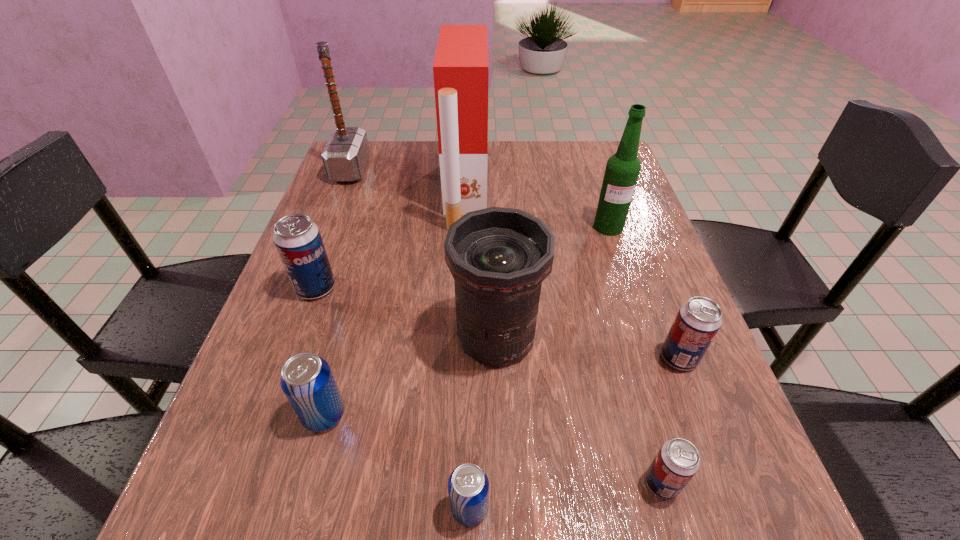
In order to click on vacant region at the near edge in this screenshot , I will do `click(634, 511)`.

Find the location of a particular element. free location at the left edge is located at coordinates (327, 350).

In the image, there is a desktop. Where is `blank space at the right edge`? blank space at the right edge is located at coordinates (661, 388).

I want to click on free space at the far left corner of the desktop, so click(x=388, y=147).

The height and width of the screenshot is (540, 960). Find the location of `vacant space in between the brown hammer and the seventh farthest object`. vacant space in between the brown hammer and the seventh farthest object is located at coordinates (337, 292).

The width and height of the screenshot is (960, 540). Find the location of `free spot between the beer bottle and the rightmost red beer can`. free spot between the beer bottle and the rightmost red beer can is located at coordinates click(x=643, y=292).

Find the location of a particular element. This screenshot has width=960, height=540. vacant region between the fourth beer can from left to right and the sixth shortest object is located at coordinates (579, 410).

Identify the location of free spot between the telephoto lens and the green beer bottle. (552, 282).

The image size is (960, 540). In order to click on free area in between the leftmost red beer can and the cigarette case in this screenshot , I will do `click(391, 240)`.

This screenshot has width=960, height=540. Identify the location of vacant area that lies between the red cigarette case and the beer bottle. (538, 210).